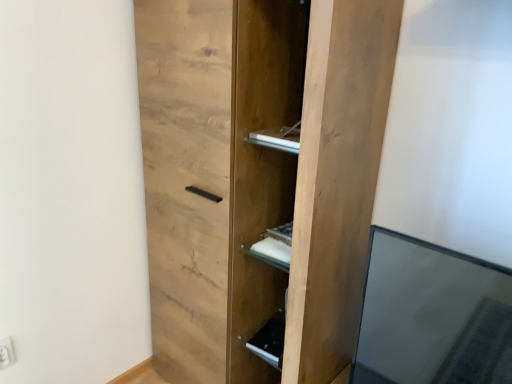
Question: From the image's perspective, is natural wood cupboard at center above or below matte wood cabinet at lower center?

Choices:
 (A) below
 (B) above

Answer: (B)

Question: Which is correct: natural wood cupboard at center is inside matte wood cabinet at lower center, or outside of it?

Choices:
 (A) inside
 (B) outside

Answer: (B)

Question: Which is nearer to the white plastic electric outlet at lower left?

Choices:
 (A) natural wood cupboard at center
 (B) matte wood cabinet at lower center

Answer: (B)

Question: Which object is positioned closest to the natural wood cupboard at center?

Choices:
 (A) matte wood cabinet at lower center
 (B) white plastic electric outlet at lower left

Answer: (A)